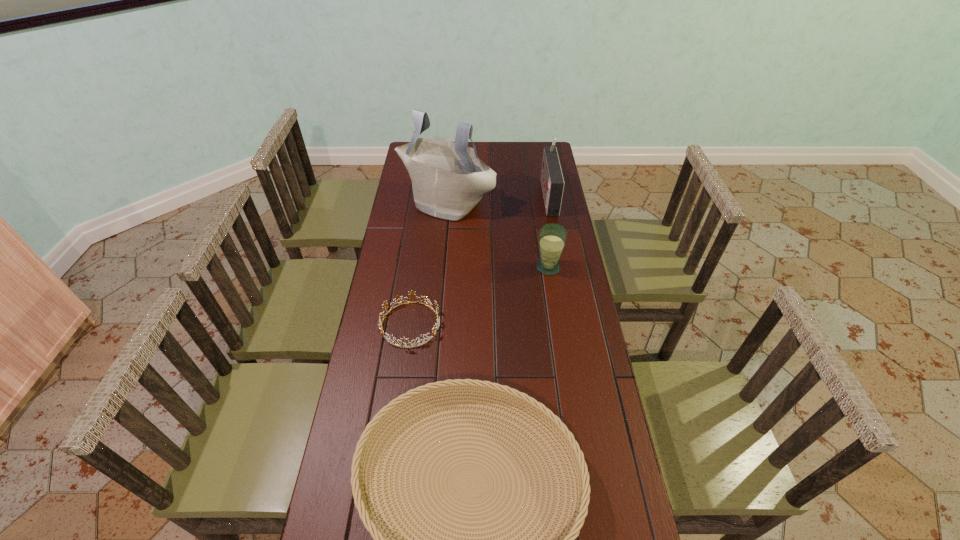
Where is `vacant point located between the shortest object and the fourth shortest object`? This screenshot has height=540, width=960. vacant point located between the shortest object and the fourth shortest object is located at coordinates (479, 260).

The height and width of the screenshot is (540, 960). In order to click on free space between the shopping bag and the fourth shortest object in this screenshot , I will do `click(497, 198)`.

This screenshot has width=960, height=540. I want to click on vacant space that's between the radio receiver and the shopping bag, so click(x=497, y=198).

Find the location of `free spot between the glass and the fourth farthest object`. free spot between the glass and the fourth farthest object is located at coordinates (479, 296).

Find the location of a particular element. This screenshot has height=540, width=960. vacant space that's between the tiara and the shopping bag is located at coordinates (428, 263).

Where is `free spot between the third shortest object and the fourth farthest object`? free spot between the third shortest object and the fourth farthest object is located at coordinates (479, 296).

Find the location of a particular element. The image size is (960, 540). vacant space that is in between the third shortest object and the fourth farthest object is located at coordinates (479, 296).

I want to click on object that is the closest to the third tallest object, so click(552, 181).

Select which object appears as the fourth closest to the shopping bag. Please provide its 2D coordinates. Your answer should be formatted as a tuple, i.e. [(x, y)], where the tuple contains the x and y coordinates of a point satisfying the conditions above.

[(545, 417)]

In order to click on vacant area in the image that satisfies the following two spatial constraints: 1. on the front panel of the fourth shortest object; 2. on the front side of the third shortest object in this screenshot , I will do `click(562, 267)`.